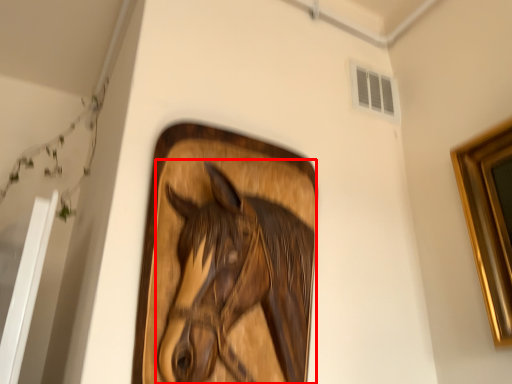
Question: From the image's perspective, where is horse (annotated by the red box) located in relation to window in the image?

Choices:
 (A) above
 (B) below

Answer: (B)